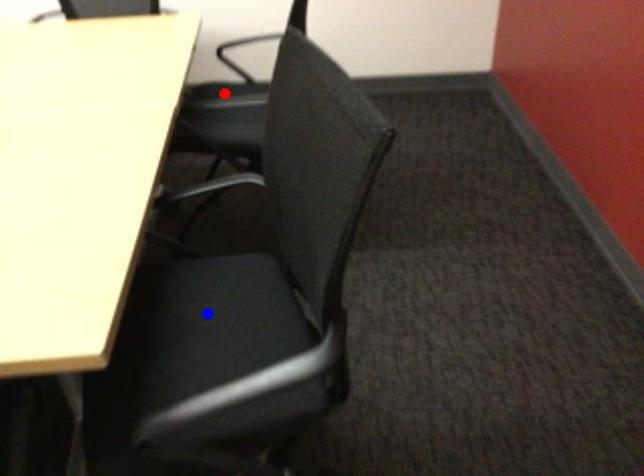
Question: Which of the two points in the image is closer to the camera?

Choices:
 (A) Blue point is closer.
 (B) Red point is closer.

Answer: (A)